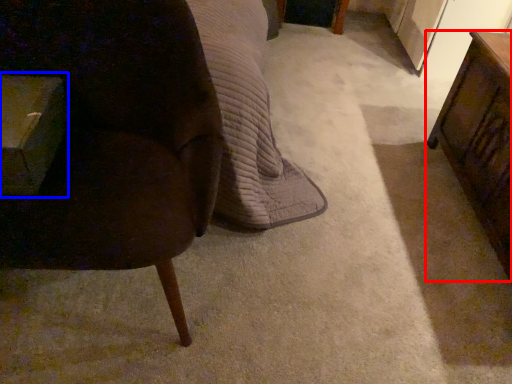
Question: Among these objects, which one is nearest to the camera, table (highlighted by a red box) or table (highlighted by a blue box)?

Choices:
 (A) table
 (B) table

Answer: (B)